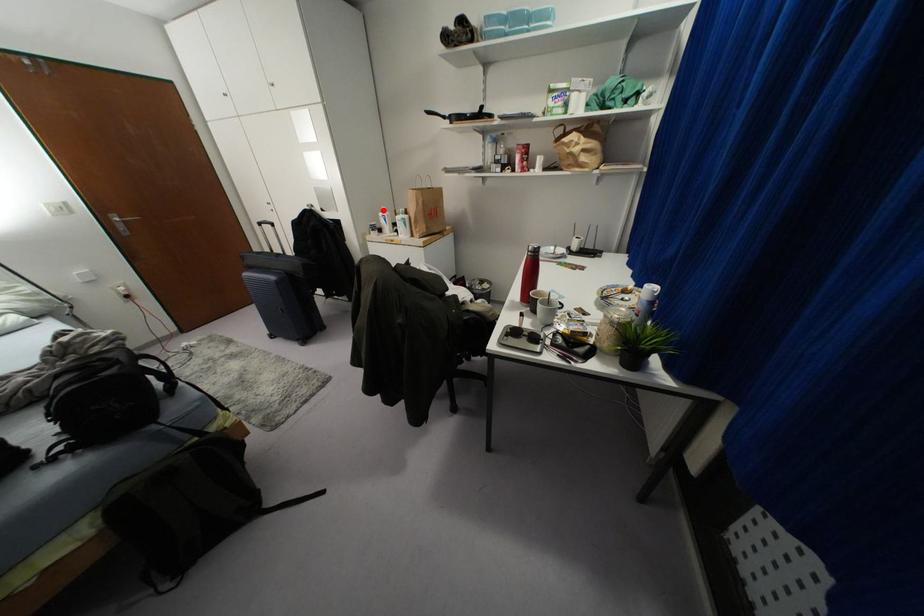
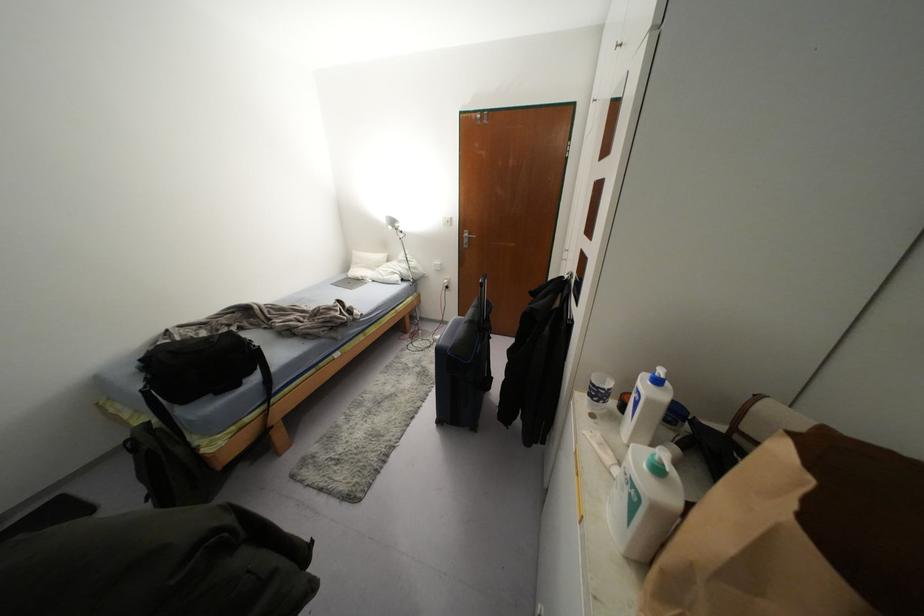
Question: I am providing you with two images of the same scene from different viewpoints. Given a red point in image1, look at the same physical point in image2. Is it:

Choices:
 (A) Closer to the viewpoint
 (B) Farther from the viewpoint

Answer: (B)